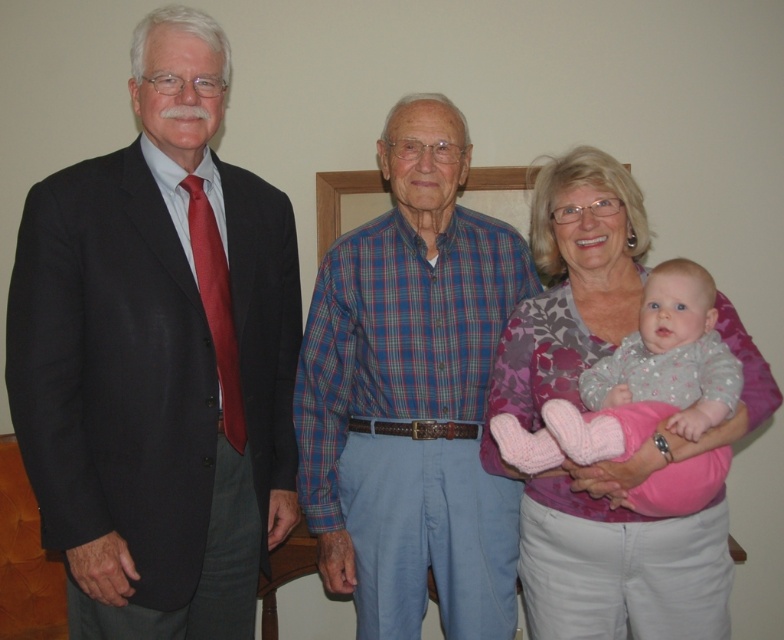
Is matte black suit at left closer to the viewer compared to floral fabric shirt at center?

Yes.

Does point (162, 144) lie behind point (645, 243)?

No, it is in front of (645, 243).

At what (x,y) coordinates should I click in order to perform the action: click on matte black suit at left. Please return your answer as a coordinate pair (x, y). This screenshot has width=784, height=640. Looking at the image, I should click on (158, 358).

In the scene shown: Who is positioned more to the left, blue plaid shirt at center or fluffy pink socks at center?

blue plaid shirt at center is more to the left.

Which of these two, blue plaid shirt at center or fluffy pink socks at center, stands shorter?

fluffy pink socks at center is shorter.

Is point (412, 118) less distant than point (665, 358)?

No, it is not.

At what (x,y) coordinates should I click in order to perform the action: click on blue plaid shirt at center. Please return your answer as a coordinate pair (x, y). Image resolution: width=784 pixels, height=640 pixels. Looking at the image, I should click on (412, 394).

Does blue plaid shirt at center have a larger size compared to floral fabric shirt at center?

No, blue plaid shirt at center is not bigger than floral fabric shirt at center.

Is point (478, 586) in front of point (750, 372)?

No, it is not.

The width and height of the screenshot is (784, 640). What are the coordinates of `blue plaid shirt at center` in the screenshot? It's located at (412, 394).